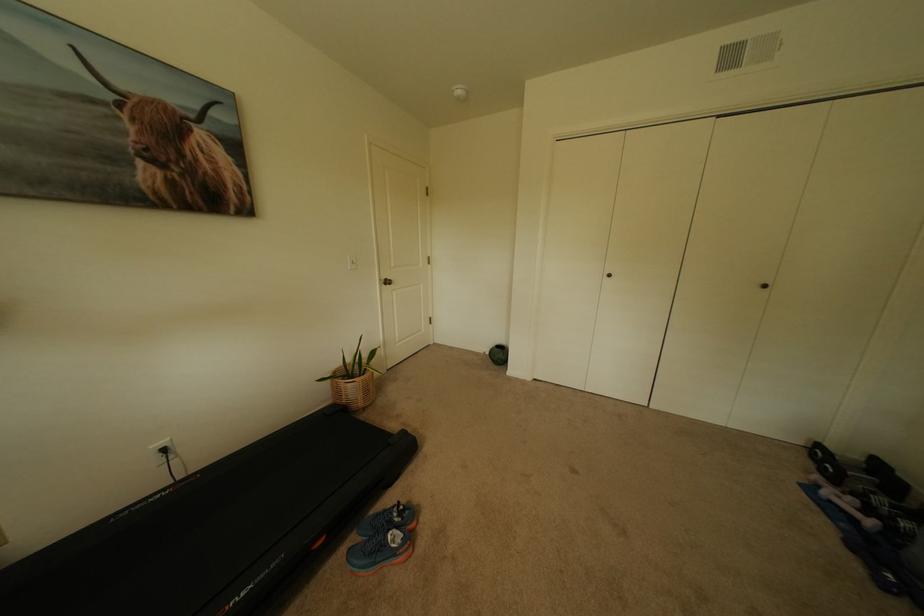
What do you see at coordinates (162, 450) in the screenshot?
I see `the power cord plug` at bounding box center [162, 450].